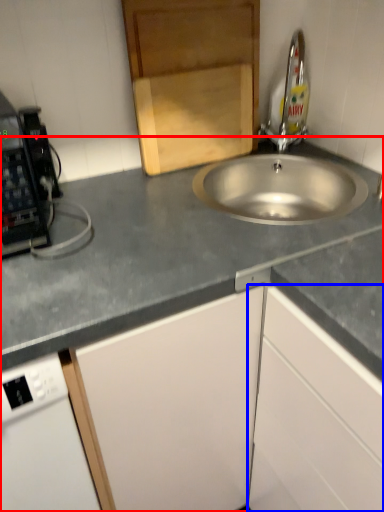
Question: Which object is closer to the camera taking this photo, countertop (highlighted by a red box) or cabinetry (highlighted by a blue box)?

Choices:
 (A) countertop
 (B) cabinetry

Answer: (A)